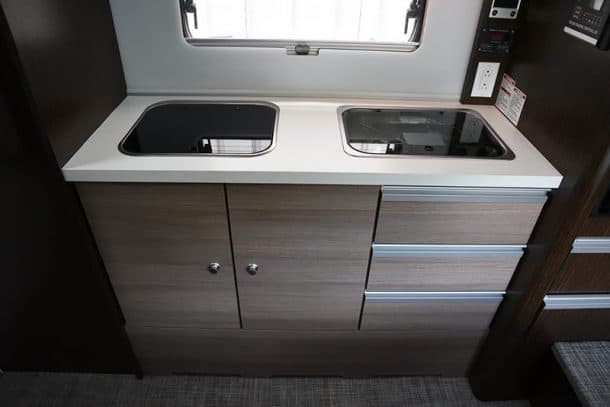
Identify the location of cabinet. (596, 274).